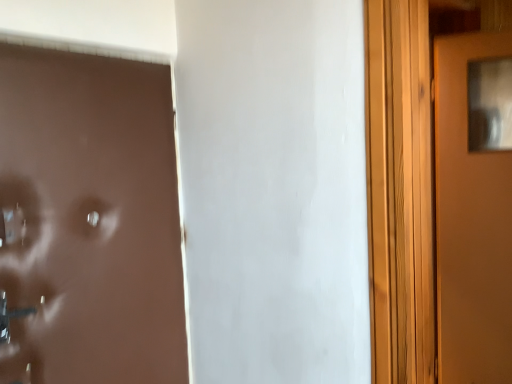
Question: From a real-world perspective, is brown matte door at right, which is counted as the first door, starting from the right, below brown matte door at left, the second door when ordered from back to front?

Choices:
 (A) no
 (B) yes

Answer: (B)

Question: Is brown matte door at right, marked as the 2th door in a front-to-back arrangement, shorter than brown matte door at left, the second door when ordered from back to front?

Choices:
 (A) no
 (B) yes

Answer: (A)

Question: Can you confirm if brown matte door at right, the 2th door viewed from the left, is bigger than brown matte door at left, the 2th door viewed from the right?

Choices:
 (A) yes
 (B) no

Answer: (B)

Question: Is brown matte door at right, marked as the 2th door in a front-to-back arrangement, aimed at brown matte door at left, the 1th door in the left-to-right sequence?

Choices:
 (A) no
 (B) yes

Answer: (A)

Question: Is brown matte door at right, marked as the 2th door in a front-to-back arrangement, surrounding brown matte door at left, the 2th door viewed from the right?

Choices:
 (A) no
 (B) yes

Answer: (A)

Question: Can you confirm if brown matte door at right, which is counted as the first door, starting from the right, is thinner than brown matte door at left, the 1th door in the left-to-right sequence?

Choices:
 (A) yes
 (B) no

Answer: (B)

Question: Does brown matte door at left, the 2th door viewed from the right, have a greater width compared to brown matte door at right, marked as the 2th door in a front-to-back arrangement?

Choices:
 (A) yes
 (B) no

Answer: (B)

Question: Can you confirm if brown matte door at left, the 2th door viewed from the right, is positioned to the right of brown matte door at right, which is counted as the first door, starting from the right?

Choices:
 (A) yes
 (B) no

Answer: (B)

Question: From the image's perspective, is brown matte door at left, the second door when ordered from back to front, below brown matte door at right, marked as the 2th door in a front-to-back arrangement?

Choices:
 (A) yes
 (B) no

Answer: (A)

Question: Is brown matte door at left, the 2th door viewed from the right, far away from brown matte door at right, the first door when ordered from back to front?

Choices:
 (A) no
 (B) yes

Answer: (B)

Question: Is brown matte door at left, the 2th door viewed from the right, facing towards brown matte door at right, marked as the 2th door in a front-to-back arrangement?

Choices:
 (A) no
 (B) yes

Answer: (A)

Question: Does brown matte door at left, the second door when ordered from back to front, have a lesser width compared to brown matte door at right, marked as the 2th door in a front-to-back arrangement?

Choices:
 (A) yes
 (B) no

Answer: (A)

Question: Would you say brown matte door at left, the 2th door viewed from the right, is inside or outside brown matte door at right, the first door when ordered from back to front?

Choices:
 (A) outside
 (B) inside

Answer: (A)